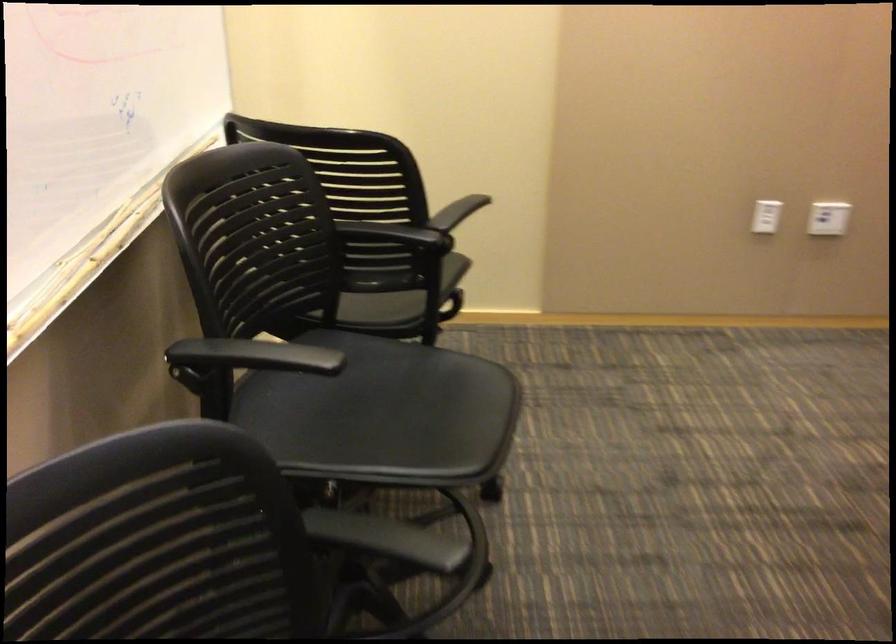
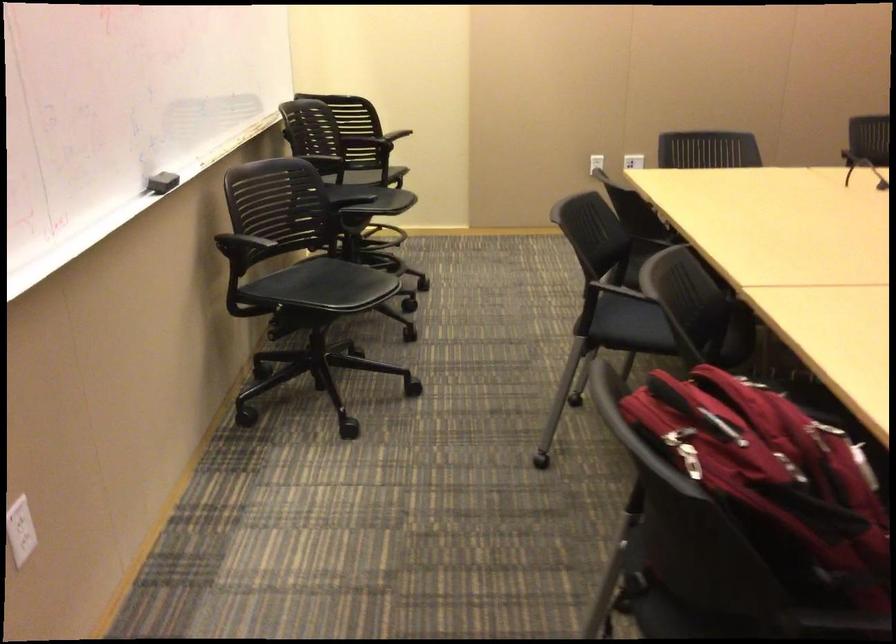
Question: What movement of the cameraman would produce the second image?

Choices:
 (A) Left
 (B) Right
 (C) Forward
 (D) Backward

Answer: (D)